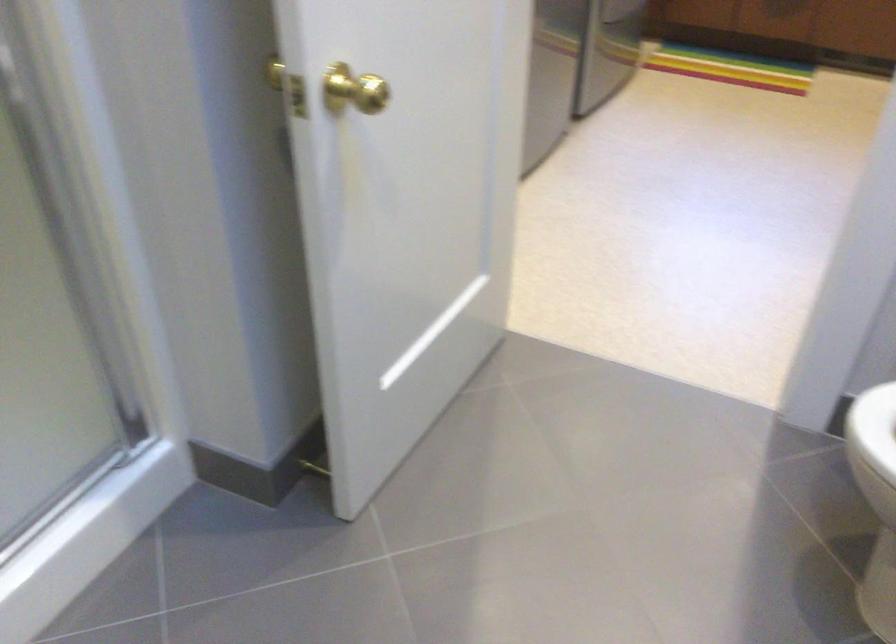
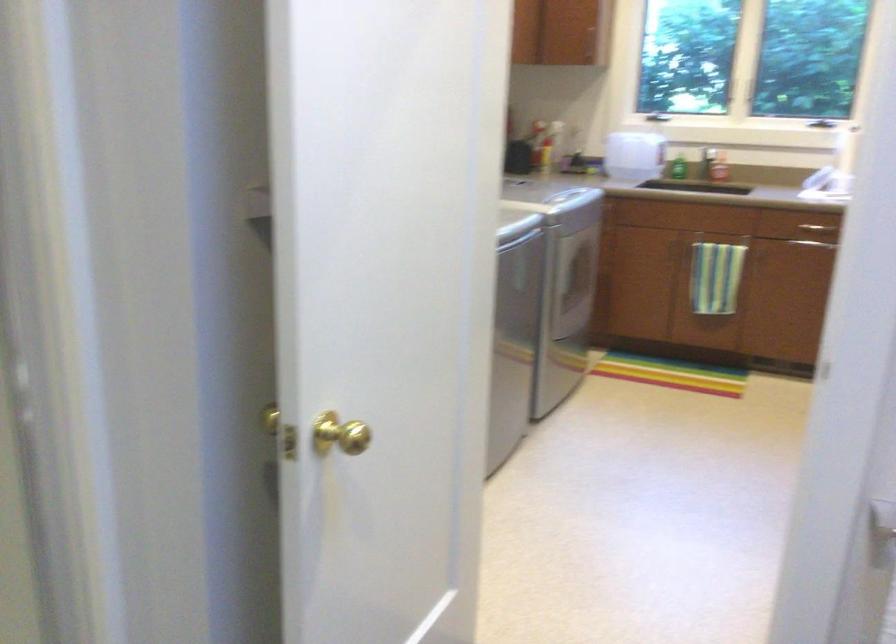
The point at [358,88] is marked in the first image. Where is the corresponding point in the second image?

(339, 433)